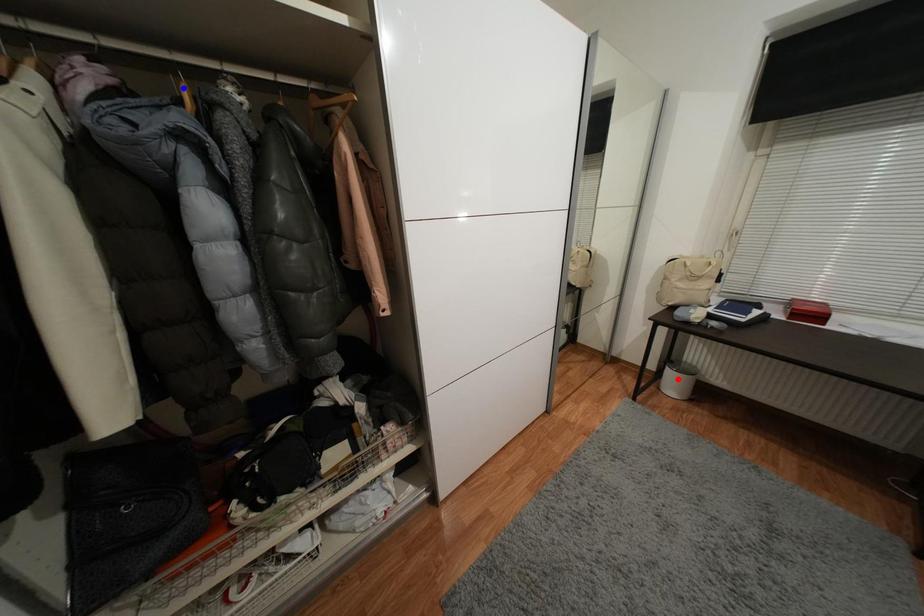
Question: Which of the two points in the image is closer to the camera?

Choices:
 (A) Blue point is closer.
 (B) Red point is closer.

Answer: (A)